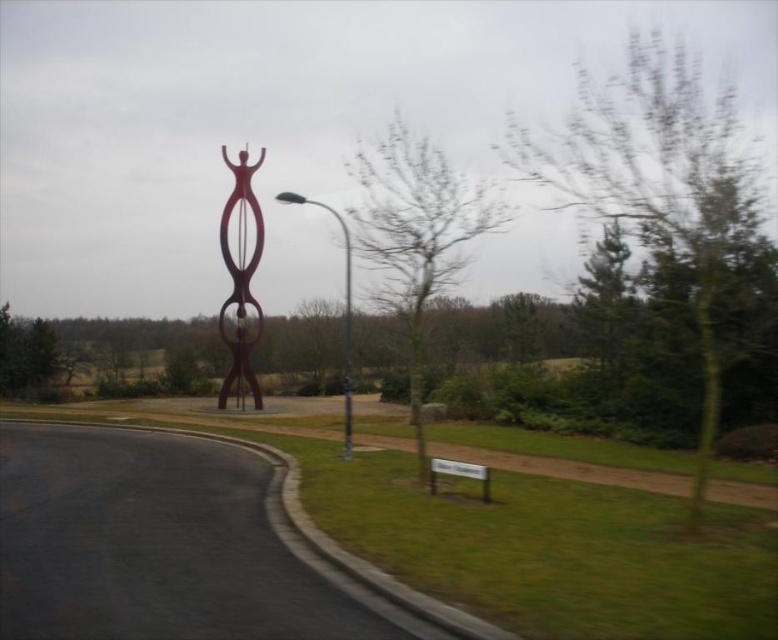
You are a photographer wanting to capture the metallic pole at center without any obstructions. You notice the green leafy tree at upper right. Based on their positions, can you position yourself in a way to exclude the tree from the frame while keeping the pole centered?

The green leafy tree at upper right is in front of the metallic pole at center, so you cannot exclude the tree from the frame while keeping the pole centered because the tree is blocking the view of the pole from that angle.

You are a photographer planning to take a photo of the green leafy tree at upper right and the metallic pole at center. Which object should you focus on first if you want to capture both in a single frame while ensuring the larger one is in sharp focus?

The green leafy tree at upper right is larger than the metallic pole at center, so you should focus on the green leafy tree at upper right first to ensure it is in sharp focus.

You are walking along the road in the image and see two points marked in the scene. The first point is at coordinate point (696,205) and the second is at point (347,448). Which point is closer to you as you walk along the road?

Point (696,205) is in front of point (347,448), so it is closer to you as you walk along the road.